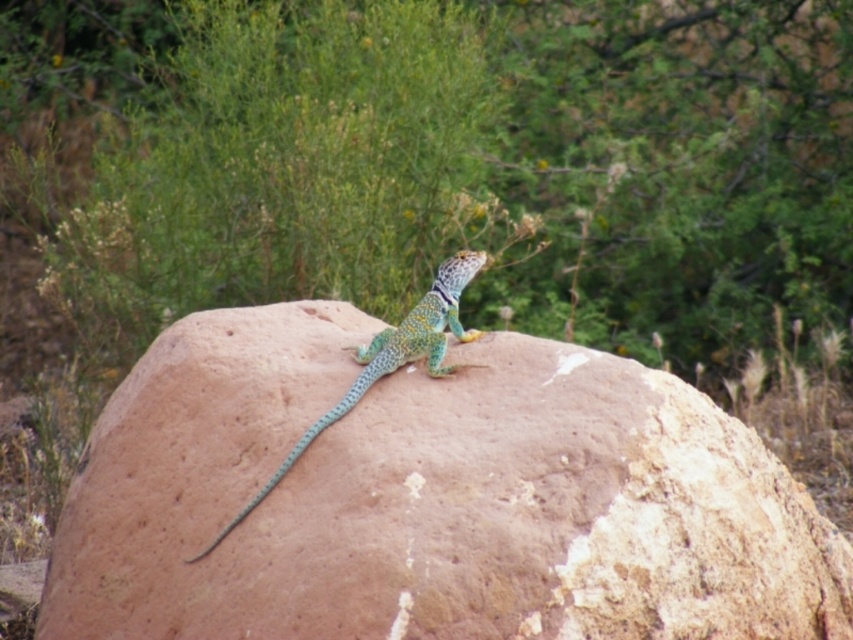
Question: Which of the following is the farthest from the observer?

Choices:
 (A) smooth brown rock at center
 (B) shiny green scales lizard at center
 (C) green scaly tail at center

Answer: (C)

Question: Which of these objects is positioned farthest from the green scaly tail at center?

Choices:
 (A) shiny green scales lizard at center
 (B) smooth brown rock at center

Answer: (B)

Question: Which object is closer to the camera taking this photo?

Choices:
 (A) green scaly tail at center
 (B) smooth brown rock at center

Answer: (B)

Question: Is smooth brown rock at center wider than shiny green scales lizard at center?

Choices:
 (A) no
 (B) yes

Answer: (B)

Question: Is the position of smooth brown rock at center more distant than that of shiny green scales lizard at center?

Choices:
 (A) yes
 (B) no

Answer: (B)

Question: Is smooth brown rock at center in front of shiny green scales lizard at center?

Choices:
 (A) yes
 (B) no

Answer: (A)